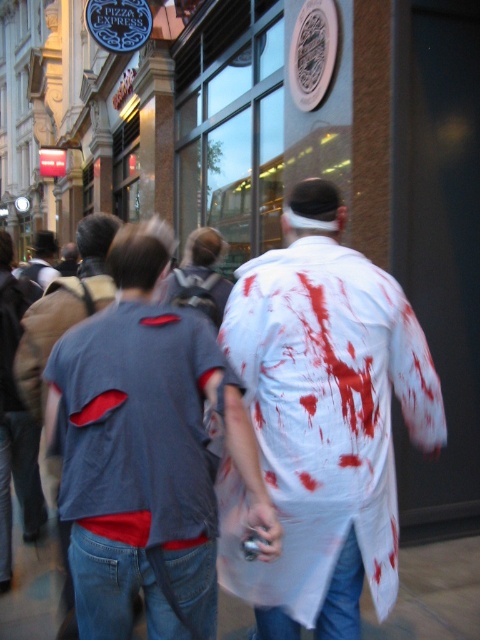
How distant is matte gray t-shirt at center from denim shirt at center?

They are 35.84 inches apart.

How distant is matte gray t-shirt at center from denim shirt at center?

A distance of 35.84 inches exists between matte gray t-shirt at center and denim shirt at center.

Who is more distant from viewer, (135,422) or (56,339)?

Positioned behind is point (56,339).

Where is `matte gray t-shirt at center`? This screenshot has height=640, width=480. matte gray t-shirt at center is located at coordinates (145, 451).

Is denim shirt at center smaller than gray fabric shirt at center?

Correct, denim shirt at center occupies less space than gray fabric shirt at center.

Is the position of denim shirt at center more distant than that of gray fabric shirt at center?

No.

Is point (16, 358) positioned behind point (55, 250)?

No, (16, 358) is in front of (55, 250).

Where is `denim shirt at center`? The height and width of the screenshot is (640, 480). denim shirt at center is located at coordinates (64, 307).

Is white matte shirt at center behind denim shirt at center?

No, white matte shirt at center is in front of denim shirt at center.

The height and width of the screenshot is (640, 480). In order to click on white matte shirt at center in this screenshot , I will do `click(323, 420)`.

Locate an element on the screen. The image size is (480, 640). white matte shirt at center is located at coordinates (323, 420).